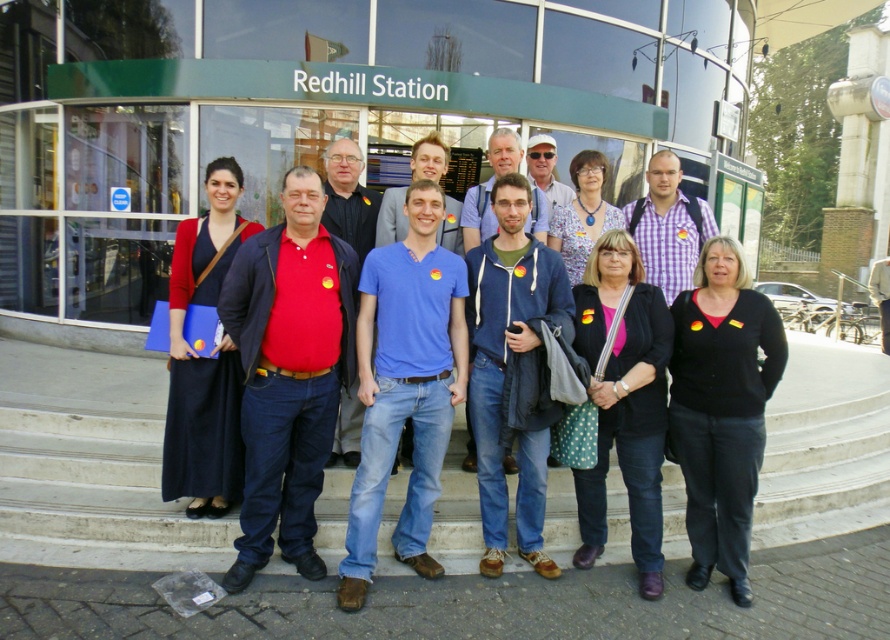
Is black matte sweater at center bigger than matte black dress at center?

Actually, black matte sweater at center might be smaller than matte black dress at center.

Identify the location of black matte sweater at center. (721, 408).

Which is more to the left, blue cotton shirt at center or black matte jacket at center?

blue cotton shirt at center is more to the left.

Between blue cotton shirt at center and black matte jacket at center, which one appears on the right side from the viewer's perspective?

Positioned to the right is black matte jacket at center.

Is point (350, 552) behind point (619, 253)?

No, it is not.

Image resolution: width=890 pixels, height=640 pixels. I want to click on blue cotton shirt at center, so click(405, 385).

Based on the photo, can you confirm if blue cotton shirt at center is positioned to the left of matte black dress at center?

Incorrect, blue cotton shirt at center is not on the left side of matte black dress at center.

Which is above, blue cotton shirt at center or matte black dress at center?

matte black dress at center is higher up.

The image size is (890, 640). I want to click on blue cotton shirt at center, so click(405, 385).